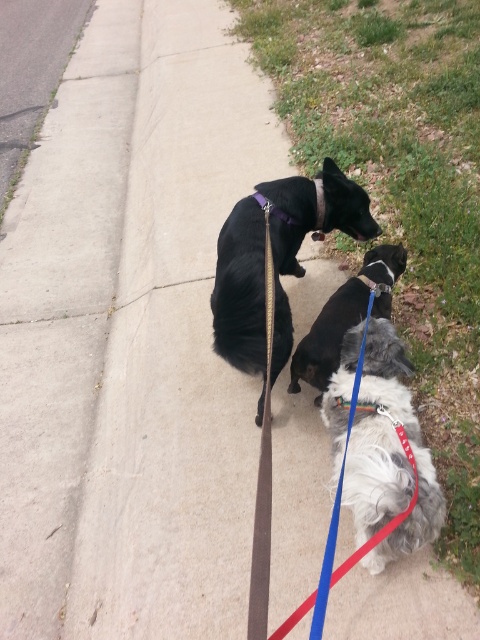
Consider the image. Between fluffy white dog at center and white fabric neckband at center, which one appears on the left side from the viewer's perspective?

Positioned to the left is white fabric neckband at center.

Is fluffy white dog at center above white fabric neckband at center?

No, fluffy white dog at center is not above white fabric neckband at center.

Who is more distant from viewer, (411, 470) or (349, 406)?

The point (349, 406) is more distant.

At what (x,y) coordinates should I click in order to perform the action: click on fluffy white dog at center. Please return your answer as a coordinate pair (x, y). Looking at the image, I should click on (388, 458).

Is black fur dog at center wider than matte purple neckband at center?

Yes, black fur dog at center is wider than matte purple neckband at center.

Which is above, black fur dog at center or matte purple neckband at center?

matte purple neckband at center is higher up.

At what (x,y) coordinates should I click in order to perform the action: click on black fur dog at center. Please return your answer as a coordinate pair (x, y). This screenshot has height=640, width=480. Looking at the image, I should click on (327, 337).

Is black fur dog at center further to camera compared to white fabric neckband at center?

Yes, black fur dog at center is further from the viewer.

Which is below, black fur dog at center or white fabric neckband at center?

Positioned lower is white fabric neckband at center.

Where is `black fur dog at center`? The height and width of the screenshot is (640, 480). black fur dog at center is located at coordinates (327, 337).